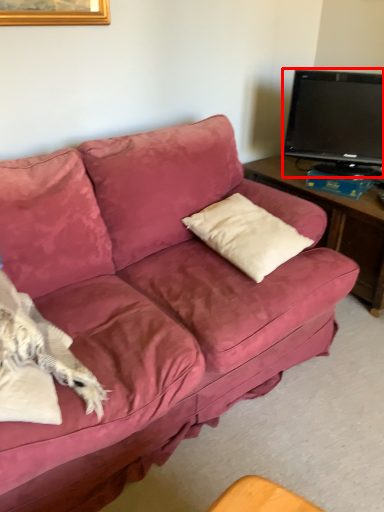
Question: From the image's perspective, what is the correct spatial positioning of television (annotated by the red box) in reference to throw pillow?

Choices:
 (A) below
 (B) above

Answer: (B)